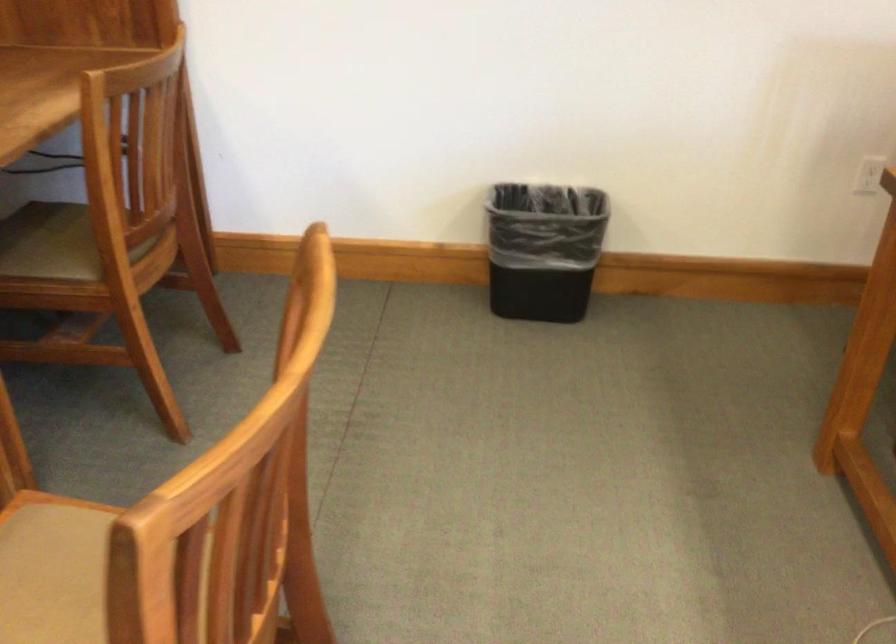
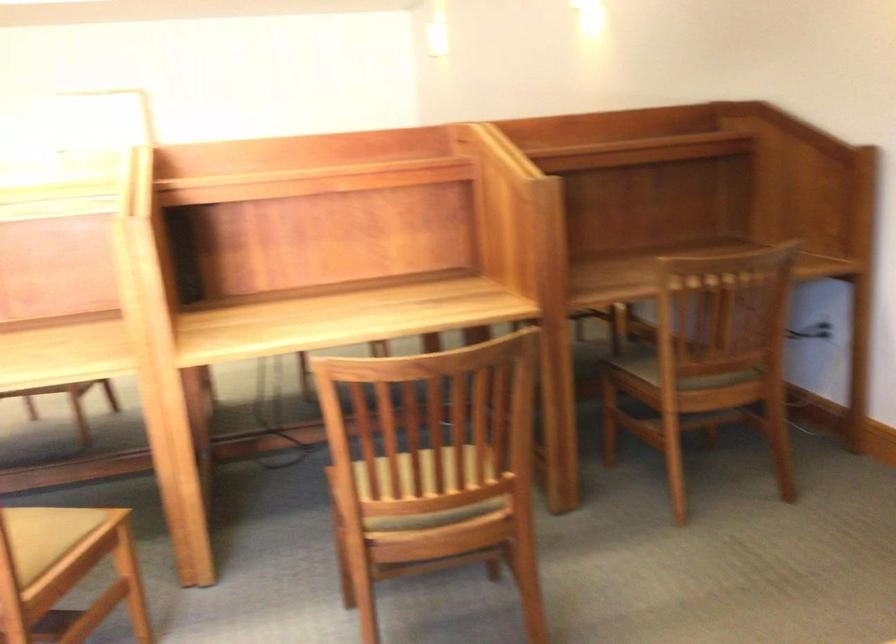
The point at (143, 230) is marked in the first image. Where is the corresponding point in the second image?

(698, 361)